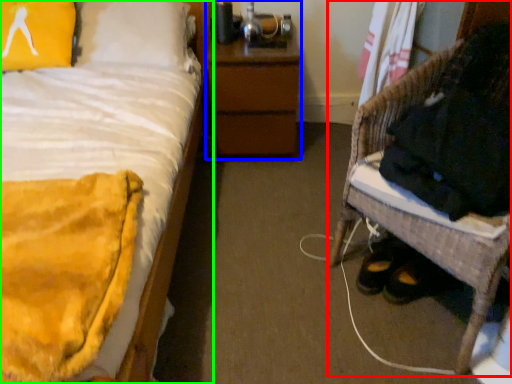
Question: Estimate the real-world distances between objects in this image. Which object is farther from furniture (highlighted by a red box), nightstand (highlighted by a blue box) or bed (highlighted by a green box)?

Choices:
 (A) nightstand
 (B) bed

Answer: (B)